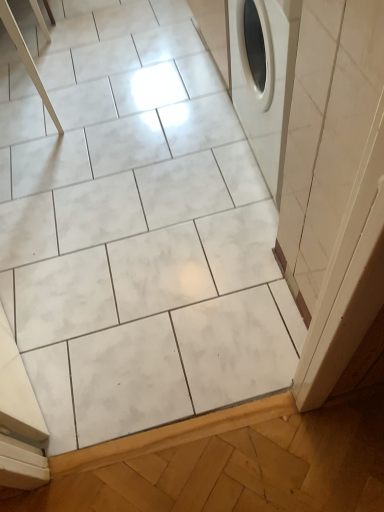
Image resolution: width=384 pixels, height=512 pixels. Describe the element at coordinates (135, 230) in the screenshot. I see `white marble tile at center` at that location.

Image resolution: width=384 pixels, height=512 pixels. Find the location of `white marble tile at center`. white marble tile at center is located at coordinates (135, 230).

Measure the distance between point (100, 130) and camera.

Point (100, 130) and camera are 1.89 meters apart from each other.

The width and height of the screenshot is (384, 512). I want to click on white marble tile at center, so click(135, 230).